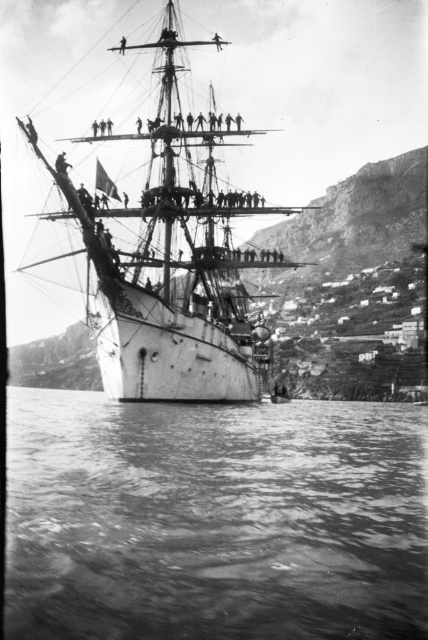
Who is higher up, smooth water at lower center or white matte ship at center?

white matte ship at center is above.

Between point (157, 480) and point (207, 150), which one is positioned in front?

Positioned in front is point (157, 480).

Identify the location of smooth water at lower center. (214, 518).